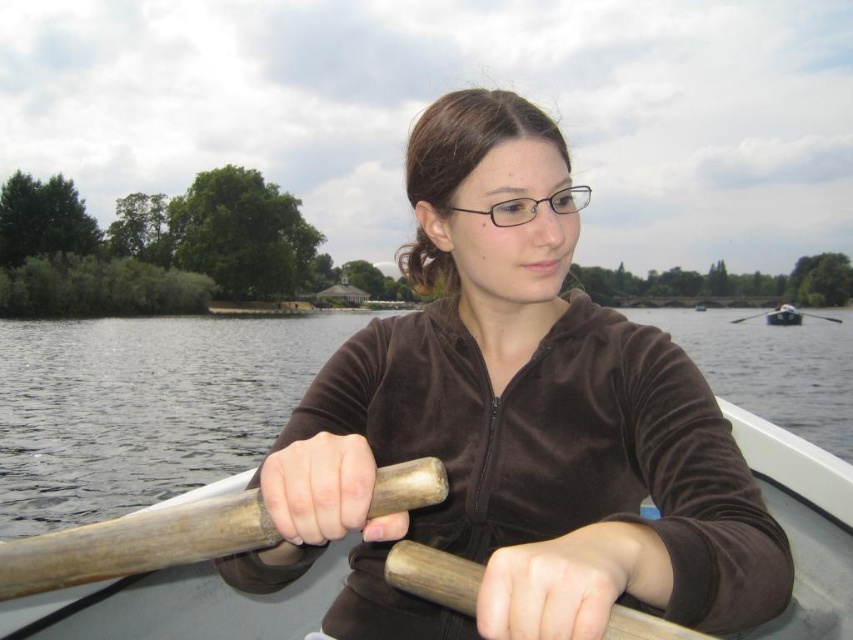
Question: Is wooden at left smaller than wooden at right?

Choices:
 (A) no
 (B) yes

Answer: (B)

Question: Among these objects, which one is farthest from the camera?

Choices:
 (A) brown velvety boat at center
 (B) wooden at right
 (C) matte brown jacket at center
 (D) brown wood oar at center

Answer: (B)

Question: Does matte brown jacket at center have a smaller size compared to wooden at right?

Choices:
 (A) no
 (B) yes

Answer: (B)

Question: Considering the relative positions of brown velvety jacket at center and brown wood oar at center in the image provided, where is brown velvety jacket at center located with respect to brown wood oar at center?

Choices:
 (A) left
 (B) right

Answer: (A)

Question: Which of the following is the closest to the observer?

Choices:
 (A) wooden at left
 (B) wooden at right
 (C) brown velvety boat at center

Answer: (A)

Question: Which object is positioned farthest from the brown velvety boat at center?

Choices:
 (A) wooden at right
 (B) brown wood oar at center

Answer: (A)